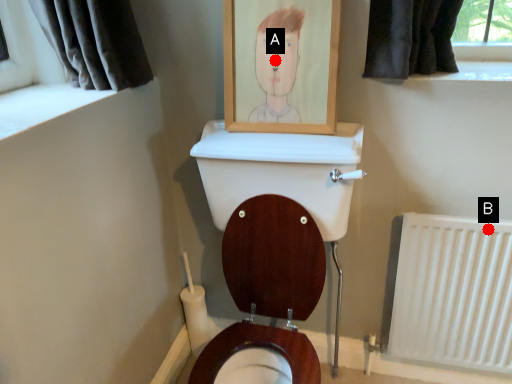
Question: Two points are circled on the image, labeled by A and B beside each circle. Which point is farther from the camera taking this photo?

Choices:
 (A) A is further
 (B) B is further

Answer: (B)